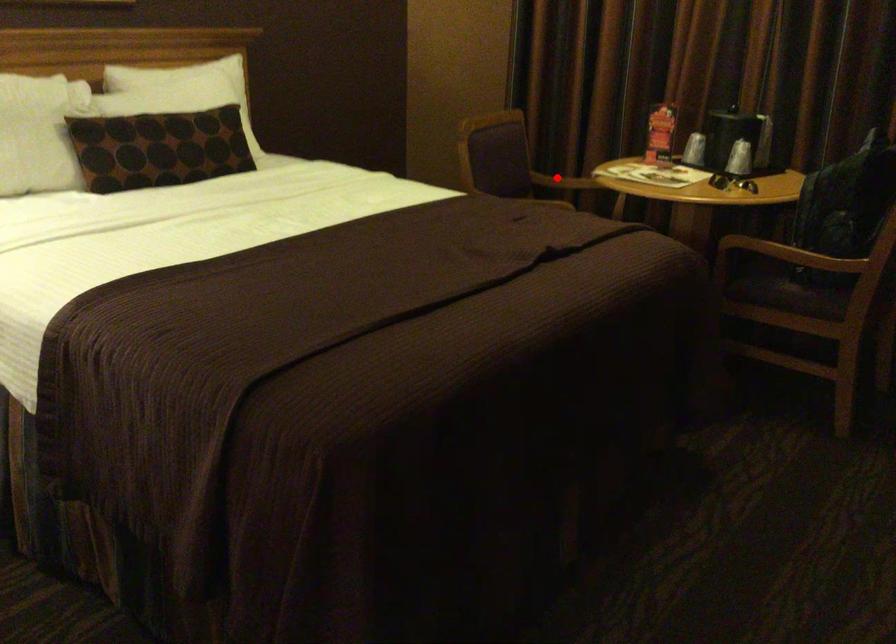
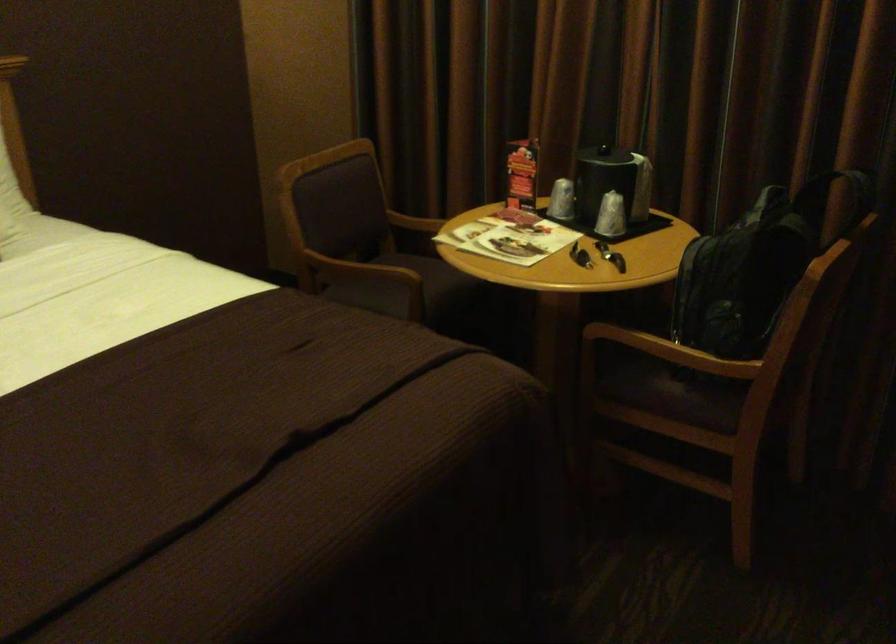
Find the pixel in the second image that matches the highlighted location in the first image.

(415, 222)